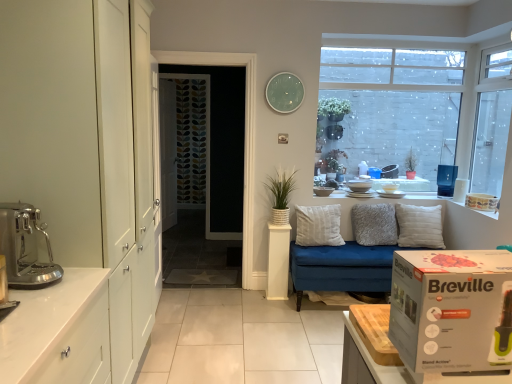
Question: Is grey fluffy pillow at center, acting as the 2th pillow starting from the right, surrounding white textured pot at center?

Choices:
 (A) no
 (B) yes

Answer: (A)

Question: Is grey fluffy pillow at center, acting as the 2th pillow starting from the right, in front of white textured pot at center?

Choices:
 (A) no
 (B) yes

Answer: (A)

Question: Is grey fluffy pillow at center, the second pillow viewed from the left, oriented away from white textured pot at center?

Choices:
 (A) yes
 (B) no

Answer: (B)

Question: Is grey fluffy pillow at center, acting as the 2th pillow starting from the right, taller than white textured pot at center?

Choices:
 (A) no
 (B) yes

Answer: (A)

Question: From a real-world perspective, is grey fluffy pillow at center, acting as the 2th pillow starting from the right, on white textured pot at center?

Choices:
 (A) no
 (B) yes

Answer: (A)

Question: From the image's perspective, is white soft cushion at center, the 3th pillow from the right, positioned above or below white glossy cabinet at lower left?

Choices:
 (A) above
 (B) below

Answer: (A)

Question: Looking at their shapes, would you say white soft cushion at center, the 3th pillow from the right, is wider or thinner than white glossy cabinet at lower left?

Choices:
 (A) thin
 (B) wide

Answer: (A)

Question: Is white soft cushion at center, the 3th pillow from the right, taller or shorter than white glossy cabinet at lower left?

Choices:
 (A) tall
 (B) short

Answer: (B)

Question: Relative to white glossy cabinet at lower left, is white soft cushion at center, positioned as the 1th pillow in left-to-right order, in front or behind?

Choices:
 (A) front
 (B) behind

Answer: (B)

Question: From a real-world perspective, relative to white glossy cabinet at left, is transparent glass window at upper right, arranged as the 1th window when viewed from the left, vertically above or below?

Choices:
 (A) below
 (B) above

Answer: (B)

Question: In terms of height, does transparent glass window at upper right, arranged as the 1th window when viewed from the left, look taller or shorter compared to white glossy cabinet at left?

Choices:
 (A) tall
 (B) short

Answer: (B)

Question: Looking at their shapes, would you say transparent glass window at upper right, arranged as the 1th window when viewed from the left, is wider or thinner than white glossy cabinet at left?

Choices:
 (A) thin
 (B) wide

Answer: (A)

Question: In the image, is transparent glass window at upper right, arranged as the 1th window when viewed from the left, positioned in front of or behind white glossy cabinet at left?

Choices:
 (A) front
 (B) behind

Answer: (B)

Question: From the image's perspective, is metallic stainless steel coffee machine at left, the fourth appliance when ordered from right to left, above or below transparent glass window at upper right, placed as the second window when sorted from left to right?

Choices:
 (A) below
 (B) above

Answer: (A)

Question: Is metallic stainless steel coffee machine at left, the fourth appliance from the top, bigger or smaller than transparent glass window at upper right, placed as the second window when sorted from left to right?

Choices:
 (A) big
 (B) small

Answer: (B)